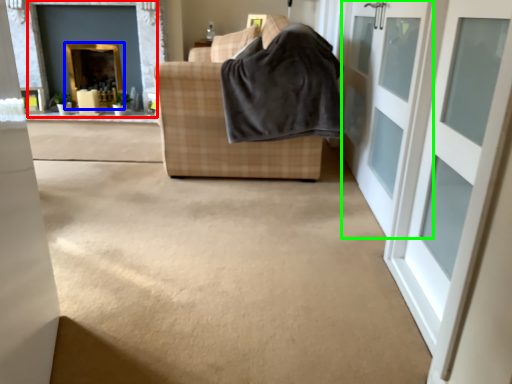
Question: Based on their relative distances, which object is farther from fireplace (highlighted by a red box)? Choose from fireplace (highlighted by a blue box) and door (highlighted by a green box).

Choices:
 (A) fireplace
 (B) door

Answer: (B)